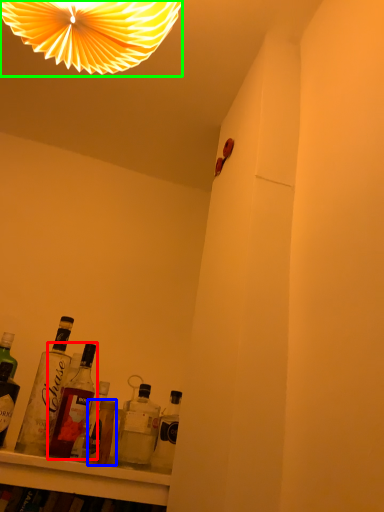
Question: Based on their relative distances, which object is farther from bottle (highlighted by a red box)? Choose from bottle (highlighted by a blue box) and lamp (highlighted by a green box).

Choices:
 (A) bottle
 (B) lamp

Answer: (B)